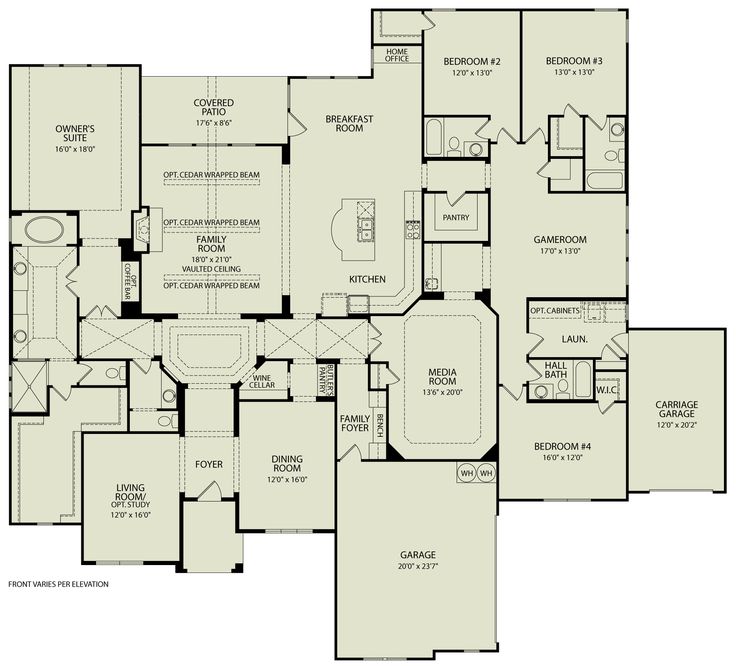
Locate an element on the screen. storage spaces is located at coordinates (417, 563), (678, 415), (611, 392), (556, 314), (458, 216), (327, 379), (263, 378), (572, 126), (562, 168), (399, 24).